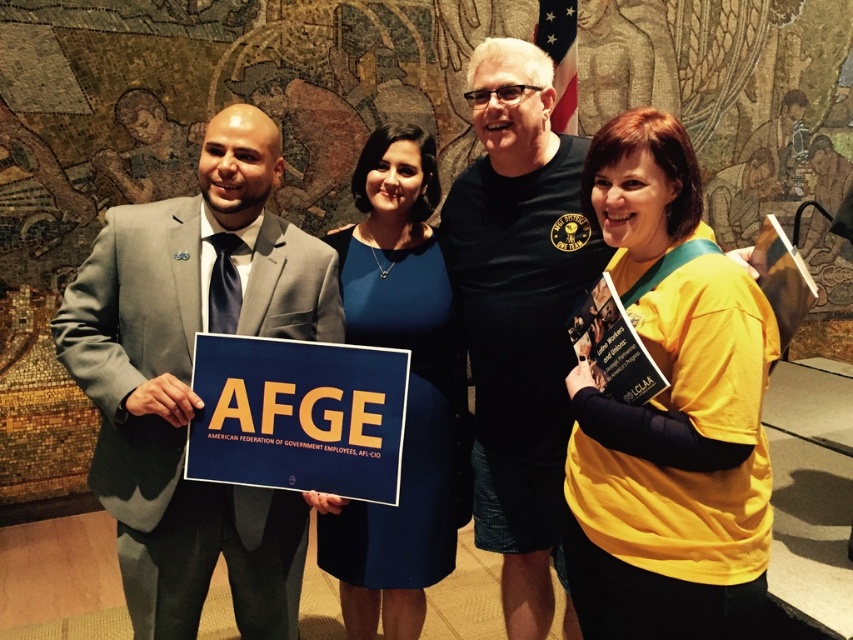
Question: Can you confirm if matte gray suit at left is bigger than blue fabric dress at center?

Choices:
 (A) no
 (B) yes

Answer: (B)

Question: Which point is closer to the camera?

Choices:
 (A) matte gray suit at left
 (B) yellow paper sign at center
 (C) blue fabric dress at center
 (D) yellow jersey at center

Answer: (D)

Question: Which point is farther to the camera?

Choices:
 (A) tap(288, 262)
 (B) tap(651, 628)
 (C) tap(445, 561)

Answer: (C)

Question: Does matte gray suit at left appear on the right side of matte yellow book at right?

Choices:
 (A) no
 (B) yes

Answer: (A)

Question: Which object is positioned farthest from the yellow paper sign at center?

Choices:
 (A) yellow jersey at center
 (B) matte yellow book at right

Answer: (A)

Question: Does matte gray suit at left have a lesser width compared to matte yellow book at right?

Choices:
 (A) no
 (B) yes

Answer: (A)